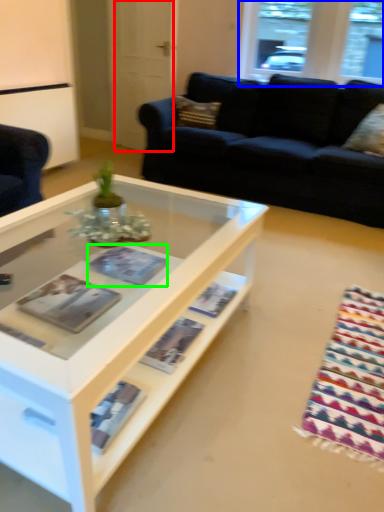
Question: Which object is the farthest from glass door (highlighted by a red box)? Choose among these: window (highlighted by a blue box) or magazine (highlighted by a green box).

Choices:
 (A) window
 (B) magazine

Answer: (B)